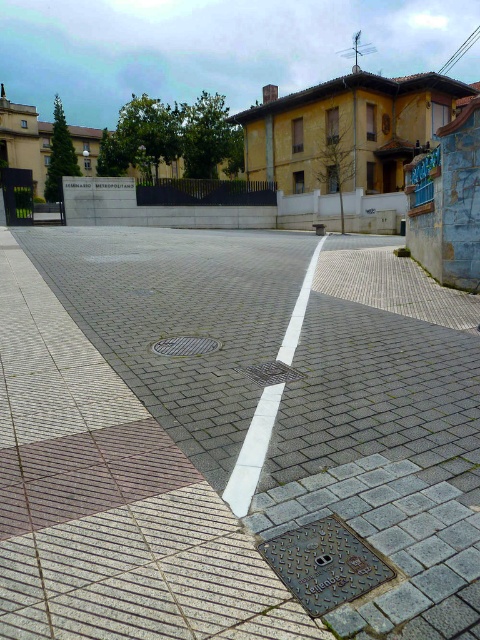
Which is above, gray concrete pavement at center or metallic grid manhole cover at center?

gray concrete pavement at center is above.

Is gray concrete pavement at center below metallic grid manhole cover at center?

Actually, gray concrete pavement at center is above metallic grid manhole cover at center.

Where is `gray concrete pavement at center`? gray concrete pavement at center is located at coordinates (226, 436).

At what (x,y) coordinates should I click in order to perform the action: click on gray concrete pavement at center. Please return your answer as a coordinate pair (x, y). Looking at the image, I should click on (226, 436).